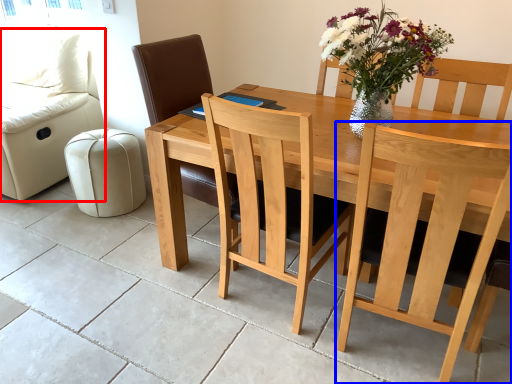
Question: Among these objects, which one is nearest to the camera, couch (highlighted by a red box) or chair (highlighted by a blue box)?

Choices:
 (A) couch
 (B) chair

Answer: (B)